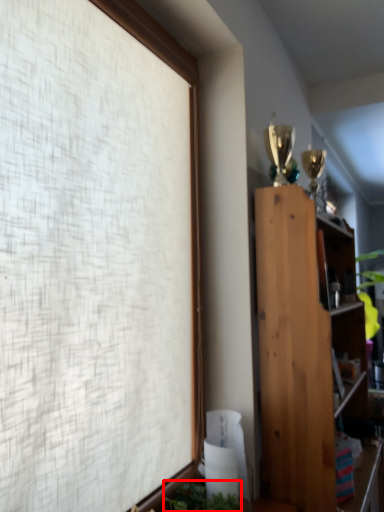
Question: Observing the image, what is the correct spatial positioning of plant (annotated by the red box) in reference to bookcase?

Choices:
 (A) left
 (B) right

Answer: (A)